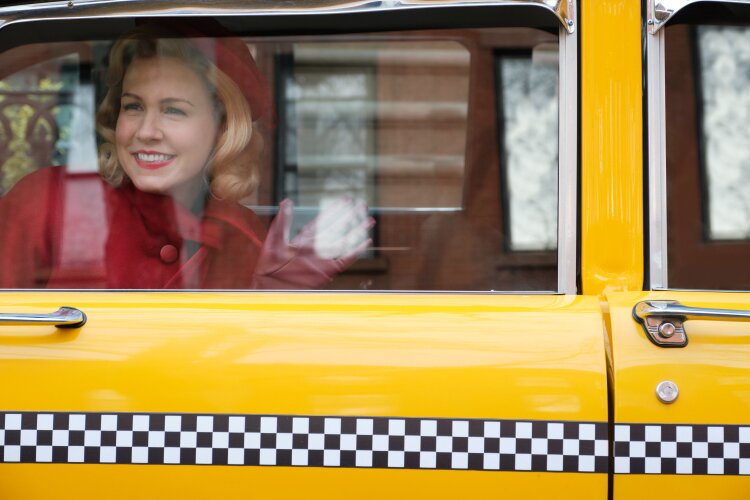
You are a GUI agent. You are given a task and a screenshot of the screen. Output one action in this format:
    pyautogui.click(x=<x>, y=<y>)
    Task: Click on the door handles
    The height and width of the screenshot is (500, 750).
    Given the screenshot: What is the action you would take?
    pyautogui.click(x=55, y=317), pyautogui.click(x=674, y=314)